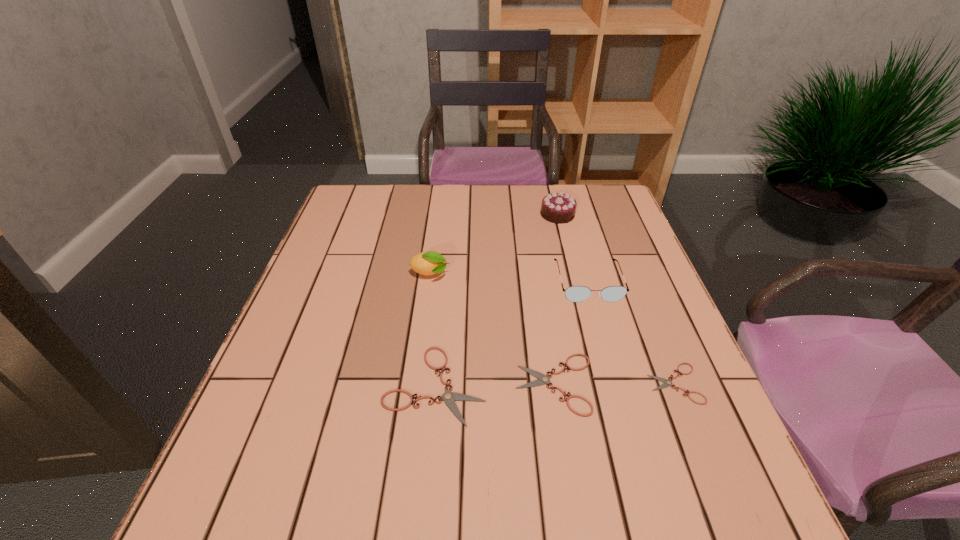
Locate an element on the screen. vacant area at the far edge of the desktop is located at coordinates (448, 190).

In the image, there is a desktop. Identify the location of vacant space at the near edge. Image resolution: width=960 pixels, height=540 pixels. (589, 458).

I want to click on free region at the left edge of the desktop, so click(339, 318).

Find the location of a particular element. free location at the right edge of the desktop is located at coordinates (683, 333).

Locate an element on the screen. vacant space at the far left corner of the desktop is located at coordinates (354, 221).

Identify the location of free space at the near left corner. Image resolution: width=960 pixels, height=540 pixels. (308, 427).

The width and height of the screenshot is (960, 540). In the image, there is a desktop. In order to click on vacant area at the far right corner in this screenshot , I will do `click(611, 201)`.

Identify the location of free space between the leftmost shears and the lemon. (433, 329).

Identify the location of vacant area that lies between the shortest object and the spectacles. (631, 333).

The width and height of the screenshot is (960, 540). What are the coordinates of `empty location between the spectacles and the lemon` in the screenshot? It's located at (509, 278).